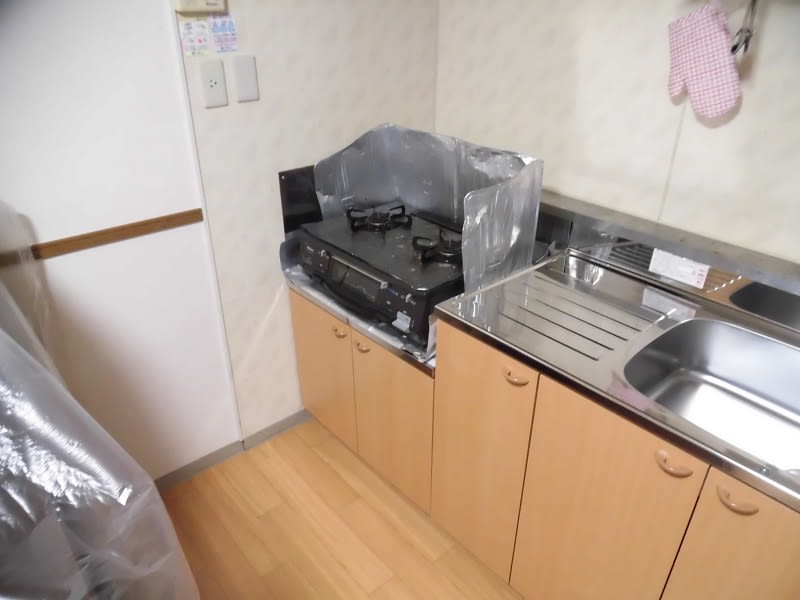
At what (x,y) coordinates should I click in order to perform the action: click on cabinet. Please return your answer as a coordinate pair (x, y). The image size is (800, 600). Looking at the image, I should click on (326, 373), (384, 391), (525, 422), (586, 452), (746, 524).